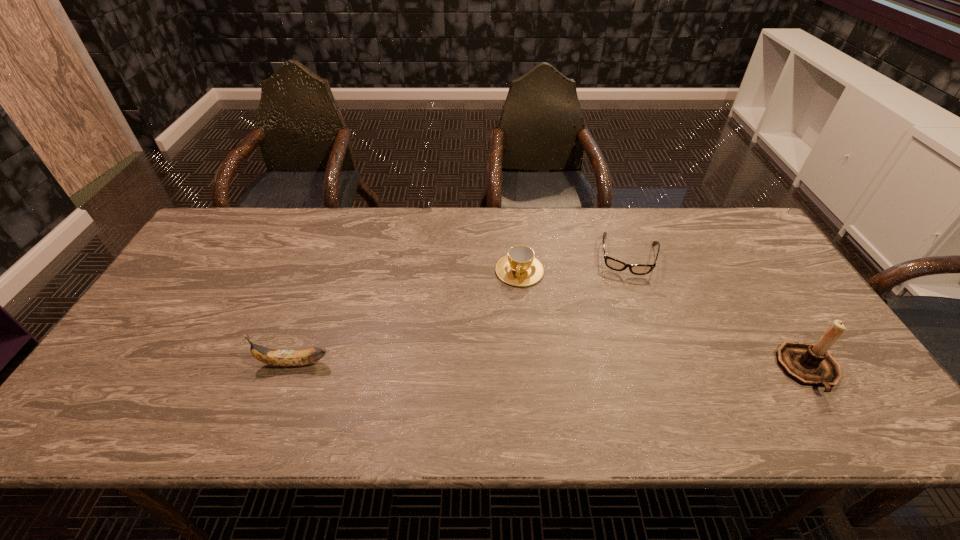
Find the location of a particular element. vacant spot on the desktop that is between the second tallest object and the tallest object and is positioned on the front-facing side of the shortest object is located at coordinates (616, 367).

Image resolution: width=960 pixels, height=540 pixels. In order to click on free space on the desktop that is between the leftmost object and the rightmost object and is positioned with the handle on the side of the cup in this screenshot , I will do `click(498, 366)`.